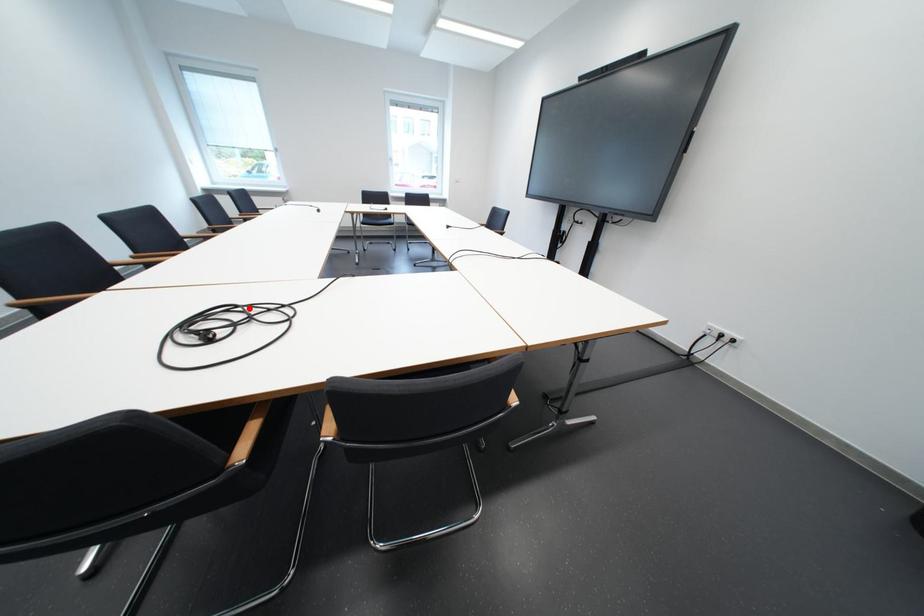
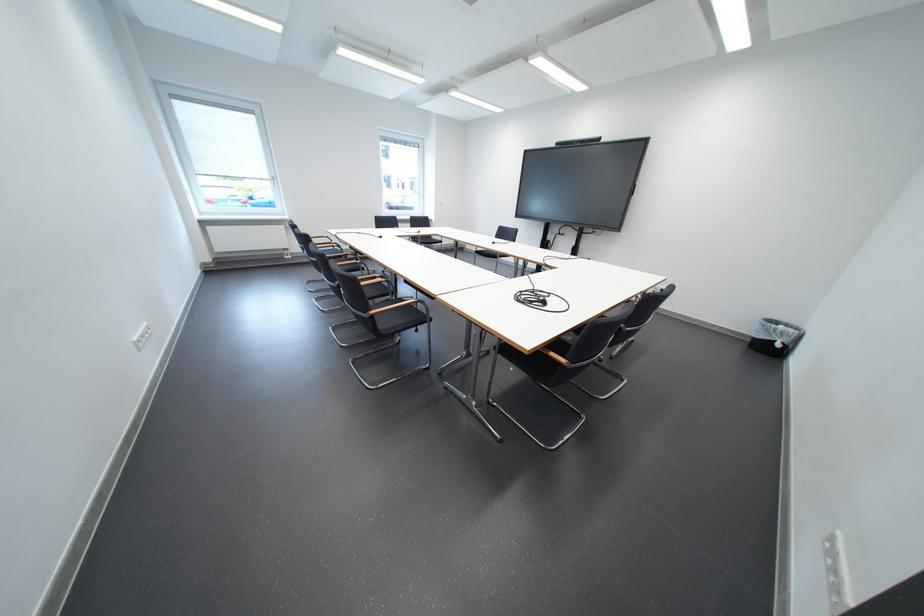
Question: I am providing you with two images of the same scene from different viewpoints. A red point is marked on the first image. At the location where the point appears in image 1, is it still visible in image 2?

Choices:
 (A) Yes
 (B) No

Answer: (A)